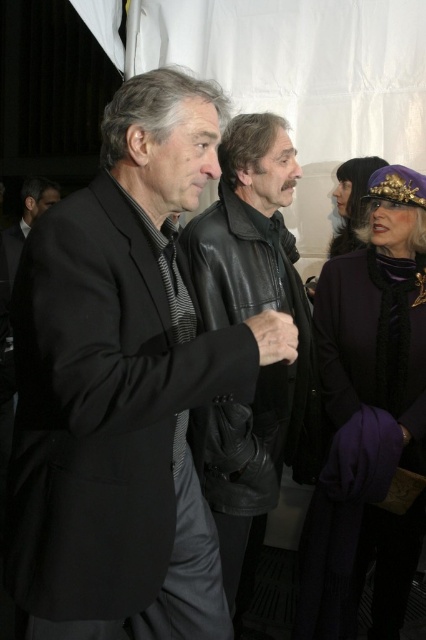
You are organizing a photo shoot and need to arrange the black matte suit at center and the purple wool coat at upper right in a way that matches their original positions. Which should be placed to the left of the other?

The black matte suit at center should be placed to the left of the purple wool coat at upper right because the black matte suit at center is positioned on the left side of purple wool coat at upper right.

You are a photographer at the event and need to adjust the lighting to ensure both the black matte suit at center and the purple wool coat at upper right are equally visible. Considering their positions, which one might require more light adjustment to achieve this?

The black matte suit at center has a lesser height compared to purple wool coat at upper right, so it might need more light adjustment to ensure visibility since it is shorter and possibly in a shadowed area.